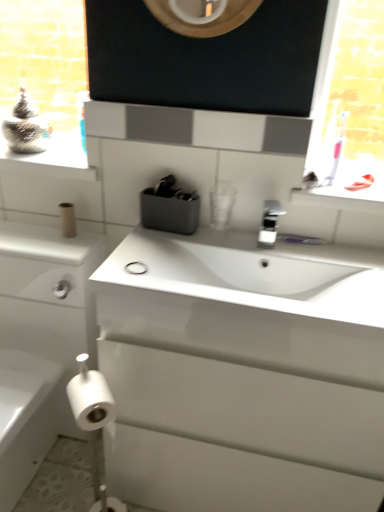
The height and width of the screenshot is (512, 384). Find the location of `free point above white glossy window sill at upper right (from a real-world perspective)`. free point above white glossy window sill at upper right (from a real-world perspective) is located at coordinates (347, 183).